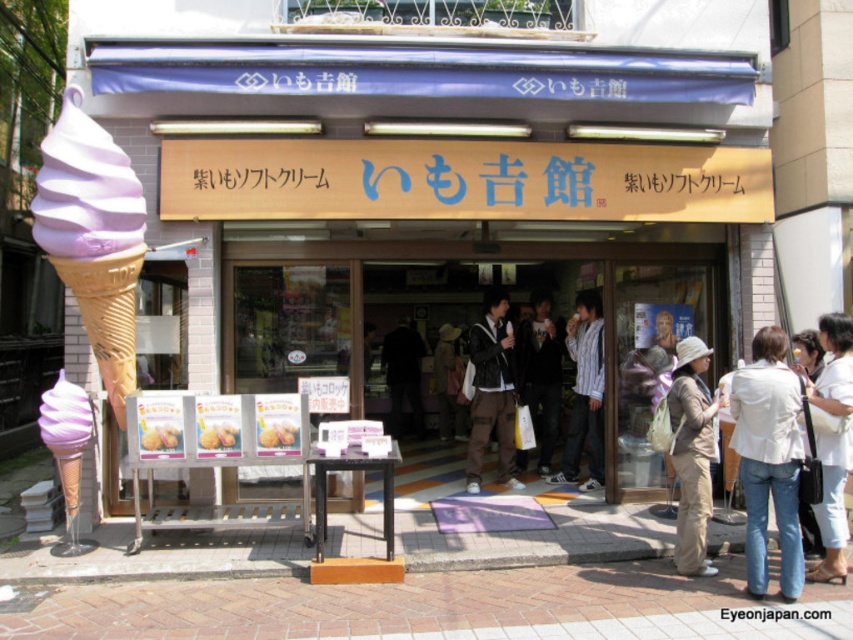
Question: Considering the relative positions of matte purple ice cream cone at center and khaki cotton pants at center in the image provided, where is matte purple ice cream cone at center located with respect to khaki cotton pants at center?

Choices:
 (A) below
 (B) above

Answer: (B)

Question: Which object appears closest to the camera in this image?

Choices:
 (A) khaki cotton pants at center
 (B) leather jacket at center
 (C) matte black jacket at center

Answer: (A)

Question: Which object is farther from the camera taking this photo?

Choices:
 (A) white leather jacket at lower right
 (B) brown leather jacket at center
 (C) matte purple ice cream cone at lower left
 (D) light beige pants at center

Answer: (B)

Question: Can you confirm if white leather jacket at lower right is positioned below light beige pants at center?

Choices:
 (A) no
 (B) yes

Answer: (B)

Question: Which of the following is the closest to the observer?

Choices:
 (A) dark blue jacket at center
 (B) lavender soft serve ice cream at left
 (C) matte purple ice cream cone at lower left
 (D) purple matte ice cream cone at left

Answer: (D)

Question: Can you confirm if matte black jacket at center is positioned to the right of purple matte ice cream cone at left?

Choices:
 (A) yes
 (B) no

Answer: (B)